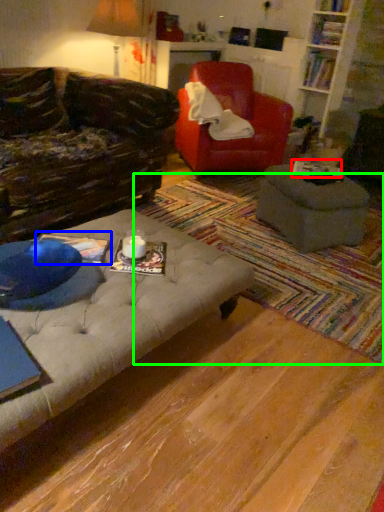
Question: Considering the real-world distances, which object is closest to book (highlighted by a red box)? book (highlighted by a blue box) or mat (highlighted by a green box).

Choices:
 (A) book
 (B) mat

Answer: (B)